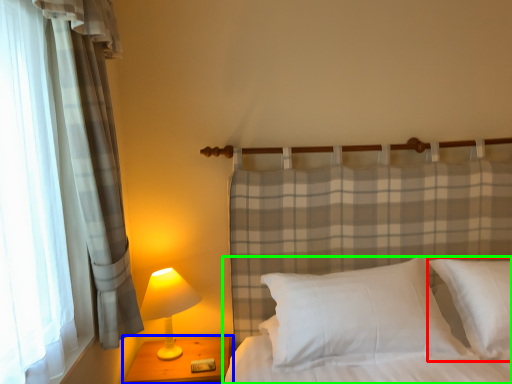
Question: Which object is the farthest from pillow (highlighted by a red box)? Choose among these: nightstand (highlighted by a blue box) or bed (highlighted by a green box).

Choices:
 (A) nightstand
 (B) bed

Answer: (A)